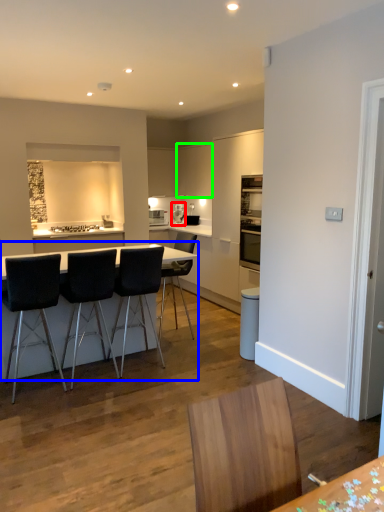
Question: Which object is the farthest from coffee machine (highlighted by a red box)? Choose among these: table (highlighted by a blue box) or cabinetry (highlighted by a green box).

Choices:
 (A) table
 (B) cabinetry

Answer: (A)